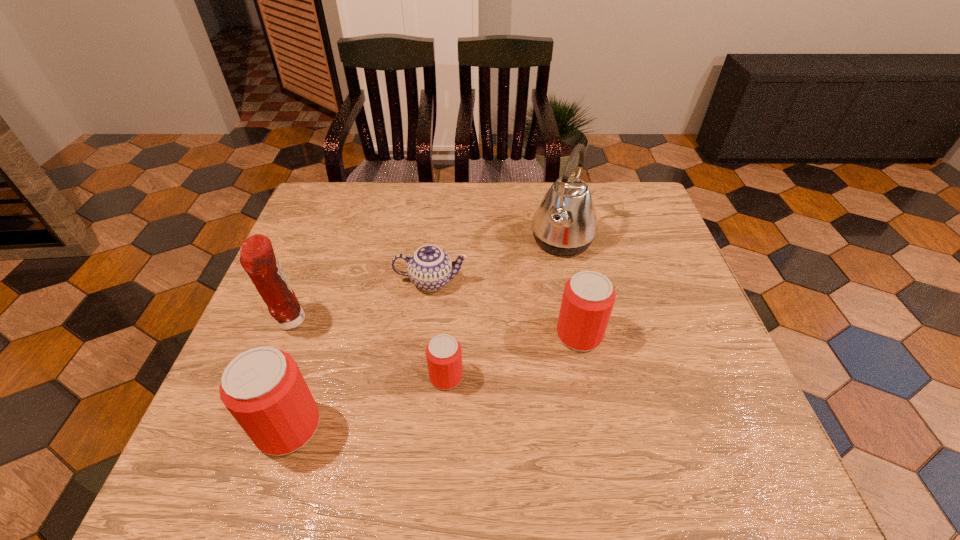
The width and height of the screenshot is (960, 540). In order to click on the nearest object in this screenshot , I will do `click(263, 388)`.

Find the location of a particular element. This screenshot has height=540, width=960. the nearest beer can is located at coordinates (263, 388).

I want to click on the fifth farthest object, so click(x=444, y=353).

Where is `the second farthest beer can`? the second farthest beer can is located at coordinates (444, 353).

Where is `the rightmost beer can`? the rightmost beer can is located at coordinates (588, 298).

At what (x,y) coordinates should I click in order to perform the action: click on the farthest beer can. Please return your answer as a coordinate pair (x, y). Looking at the image, I should click on (588, 298).

I want to click on the fifth nearest object, so click(430, 268).

You are a GUI agent. You are given a task and a screenshot of the screen. Output one action in this format:
    pyautogui.click(x=<x>, y=<y>)
    Task: Click on the tallest object
    
    Given the screenshot: What is the action you would take?
    pyautogui.click(x=565, y=224)

Where is `kettle`? kettle is located at coordinates (565, 224).

The image size is (960, 540). Find the location of `condiment`. condiment is located at coordinates (257, 257).